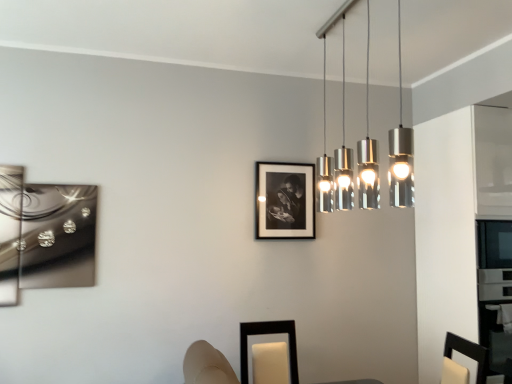
Describe the element at coordinates (269, 353) in the screenshot. The width and height of the screenshot is (512, 384). I see `black matte picture frame at lower center, which ranks as the third picture frame in top-to-bottom order` at that location.

In order to face black matte picture frame at center, acting as the third picture frame starting from the bottom, should I rotate leftwards or rightwards?

It's best to rotate right around 4.176 degrees.

Image resolution: width=512 pixels, height=384 pixels. Identify the location of black matte picture frame at center, acting as the third picture frame starting from the bottom. (284, 201).

This screenshot has width=512, height=384. I want to click on silver metallic pendant lights at upper center, so click(x=401, y=151).

The height and width of the screenshot is (384, 512). I want to click on black matte picture frame at lower center, placed as the third picture frame when sorted from back to front, so click(x=269, y=353).

Considering the positions of point (280, 209) and point (42, 232), is point (280, 209) closer or farther from the camera than point (42, 232)?

Point (280, 209) appears to be farther away from the viewer than point (42, 232).

Is the depth of black matte picture frame at center, the 3th picture frame viewed from the left, less than that of metallic silver abstract art at left, which is counted as the second picture frame, starting from the front?

No, it is behind metallic silver abstract art at left, which is counted as the second picture frame, starting from the front.

Considering the sizes of objects black matte picture frame at center, positioned as the third picture frame in front-to-back order, and metallic silver abstract art at left, placed as the 2th picture frame when sorted from bottom to top, in the image provided, who is wider, black matte picture frame at center, positioned as the third picture frame in front-to-back order, or metallic silver abstract art at left, placed as the 2th picture frame when sorted from bottom to top,?

metallic silver abstract art at left, placed as the 2th picture frame when sorted from bottom to top.

Between black matte picture frame at center, positioned as the 1th picture frame in back-to-front order, and silver metallic pendant lights at upper center, which one appears on the right side from the viewer's perspective?

From the viewer's perspective, silver metallic pendant lights at upper center appears more on the right side.

From a real-world perspective, which picture frame is the 1st one underneath the silver metallic pendant lights at upper center? Please provide its 2D coordinates.

[(284, 201)]

Which is correct: black matte picture frame at center, which appears as the 1th picture frame when viewed from the top, is inside silver metallic pendant lights at upper center, or outside of it?

black matte picture frame at center, which appears as the 1th picture frame when viewed from the top, is not enclosed by silver metallic pendant lights at upper center.

From a real-world perspective, who is located lower, metallic silver abstract art at left, placed as the 2th picture frame when sorted from bottom to top, or black matte picture frame at lower center, the 2th picture frame when ordered from right to left?

black matte picture frame at lower center, the 2th picture frame when ordered from right to left.

Can you confirm if metallic silver abstract art at left, placed as the 2th picture frame when sorted from bottom to top, is positioned to the right of black matte picture frame at lower center, which ranks as the third picture frame in top-to-bottom order?

Incorrect, metallic silver abstract art at left, placed as the 2th picture frame when sorted from bottom to top, is not on the right side of black matte picture frame at lower center, which ranks as the third picture frame in top-to-bottom order.

How many degrees apart are the facing directions of metallic silver abstract art at left, arranged as the 2th picture frame when viewed from the top, and black matte picture frame at lower center, placed as the third picture frame when sorted from back to front?

They differ by 0.782 degrees in their facing directions.

Could you measure the distance between metallic silver abstract art at left, which ranks as the 3th picture frame in right-to-left order, and black matte picture frame at lower center, placed as the third picture frame when sorted from back to front?

metallic silver abstract art at left, which ranks as the 3th picture frame in right-to-left order, and black matte picture frame at lower center, placed as the third picture frame when sorted from back to front, are 3.99 feet apart.

Considering the sizes of objects black matte picture frame at lower center, the 2th picture frame when ordered from right to left, and silver metallic pendant lights at upper center in the image provided, who is shorter, black matte picture frame at lower center, the 2th picture frame when ordered from right to left, or silver metallic pendant lights at upper center?

With less height is black matte picture frame at lower center, the 2th picture frame when ordered from right to left.

Considering the points (274, 333) and (393, 163), which point is behind, point (274, 333) or point (393, 163)?

Positioned behind is point (274, 333).

Does black matte picture frame at lower center, placed as the third picture frame when sorted from back to front, turn towards silver metallic pendant lights at upper center?

No.

From the image's perspective, which one is positioned higher, silver metallic pendant lights at upper center or black matte picture frame at lower center, positioned as the second picture frame in left-to-right order?

silver metallic pendant lights at upper center.

Do you think silver metallic pendant lights at upper center is within black matte picture frame at lower center, positioned as the second picture frame in left-to-right order, or outside of it?

silver metallic pendant lights at upper center is located beyond the bounds of black matte picture frame at lower center, positioned as the second picture frame in left-to-right order.

Does silver metallic pendant lights at upper center turn towards black matte picture frame at lower center, positioned as the second picture frame in left-to-right order?

No.

Can you confirm if silver metallic pendant lights at upper center is positioned to the left of black matte picture frame at lower center, the 2th picture frame when ordered from right to left?

In fact, silver metallic pendant lights at upper center is to the right of black matte picture frame at lower center, the 2th picture frame when ordered from right to left.

Is metallic silver abstract art at left, which is the 2th picture frame in back-to-front order, shorter than black matte picture frame at center, which appears as the 1th picture frame when viewed from the top?

In fact, metallic silver abstract art at left, which is the 2th picture frame in back-to-front order, may be taller than black matte picture frame at center, which appears as the 1th picture frame when viewed from the top.

Which object is positioned more to the right, metallic silver abstract art at left, which ranks as the 3th picture frame in right-to-left order, or black matte picture frame at center, acting as the third picture frame starting from the bottom?

Positioned to the right is black matte picture frame at center, acting as the third picture frame starting from the bottom.

How distant is metallic silver abstract art at left, which is the first picture frame in left-to-right order, from black matte picture frame at center, positioned as the third picture frame in front-to-back order?

metallic silver abstract art at left, which is the first picture frame in left-to-right order, and black matte picture frame at center, positioned as the third picture frame in front-to-back order, are 1.25 meters apart from each other.

Is metallic silver abstract art at left, placed as the 2th picture frame when sorted from bottom to top, positioned far away from black matte picture frame at center, the 3th picture frame viewed from the left?

metallic silver abstract art at left, placed as the 2th picture frame when sorted from bottom to top, is far away from black matte picture frame at center, the 3th picture frame viewed from the left.

Which is nearer, (303,234) or (262,347)?

Point (303,234) is positioned farther from the camera compared to point (262,347).

Is black matte picture frame at center, acting as the third picture frame starting from the bottom, beside black matte picture frame at lower center, positioned as the second picture frame in left-to-right order?

No.

Is black matte picture frame at center, the 3th picture frame viewed from the left, oriented towards black matte picture frame at lower center, positioned as the second picture frame in left-to-right order?

No, black matte picture frame at center, the 3th picture frame viewed from the left, does not turn towards black matte picture frame at lower center, positioned as the second picture frame in left-to-right order.

Is the position of black matte picture frame at center, marked as the first picture frame in a right-to-left arrangement, less distant than that of black matte picture frame at lower center, placed as the third picture frame when sorted from back to front?

No, black matte picture frame at center, marked as the first picture frame in a right-to-left arrangement, is further to the viewer.

This screenshot has height=384, width=512. What are the coordinates of `picture frame that is the 2nd one when counting leftward from the black matte picture frame at center, which appears as the 1th picture frame when viewed from the top` in the screenshot? It's located at (51, 231).

The height and width of the screenshot is (384, 512). Identify the location of the 3rd picture frame behind the silver metallic pendant lights at upper center, counting from the anchor's position. (284, 201).

Estimate the real-world distances between objects in this image. Which object is further from silver metallic pendant lights at upper center, metallic silver abstract art at left, which ranks as the 3th picture frame in right-to-left order, or black matte picture frame at lower center, positioned as the second picture frame in left-to-right order?

metallic silver abstract art at left, which ranks as the 3th picture frame in right-to-left order, lies further to silver metallic pendant lights at upper center than the other object.

Looking at the image, which one is located further to silver metallic pendant lights at upper center, black matte picture frame at center, positioned as the 1th picture frame in back-to-front order, or black matte picture frame at lower center, acting as the 1th picture frame starting from the bottom?

black matte picture frame at lower center, acting as the 1th picture frame starting from the bottom, is further to silver metallic pendant lights at upper center.

When comparing their distances from metallic silver abstract art at left, placed as the 2th picture frame when sorted from bottom to top, does silver metallic pendant lights at upper center or black matte picture frame at center, marked as the first picture frame in a right-to-left arrangement, seem further?

Among the two, silver metallic pendant lights at upper center is located further to metallic silver abstract art at left, placed as the 2th picture frame when sorted from bottom to top.

Which object lies further to the anchor point metallic silver abstract art at left, which is the 2th picture frame in back-to-front order, black matte picture frame at center, positioned as the 1th picture frame in back-to-front order, or black matte picture frame at lower center, acting as the 1th picture frame starting from the bottom?

black matte picture frame at center, positioned as the 1th picture frame in back-to-front order, is positioned further to the anchor metallic silver abstract art at left, which is the 2th picture frame in back-to-front order.

Which object lies nearer to the anchor point black matte picture frame at lower center, which ranks as the third picture frame in top-to-bottom order, silver metallic pendant lights at upper center or black matte picture frame at center, positioned as the 1th picture frame in back-to-front order?

Based on the image, black matte picture frame at center, positioned as the 1th picture frame in back-to-front order, appears to be nearer to black matte picture frame at lower center, which ranks as the third picture frame in top-to-bottom order.

Consider the image. Based on their spatial positions, is black matte picture frame at lower center, the 2th picture frame when ordered from right to left, or metallic silver abstract art at left, which is counted as the second picture frame, starting from the front, further from black matte picture frame at center, acting as the third picture frame starting from the bottom?

Based on the image, metallic silver abstract art at left, which is counted as the second picture frame, starting from the front, appears to be further to black matte picture frame at center, acting as the third picture frame starting from the bottom.

Which object lies further to the anchor point black matte picture frame at lower center, which ranks as the third picture frame in top-to-bottom order, black matte picture frame at center, positioned as the 1th picture frame in back-to-front order, or metallic silver abstract art at left, which is the first picture frame in left-to-right order?

metallic silver abstract art at left, which is the first picture frame in left-to-right order, is positioned further to the anchor black matte picture frame at lower center, which ranks as the third picture frame in top-to-bottom order.

Estimate the real-world distances between objects in this image. Which object is further from black matte picture frame at lower center, placed as the third picture frame when sorted from back to front, metallic silver abstract art at left, which is the 2th picture frame in back-to-front order, or silver metallic pendant lights at upper center?

metallic silver abstract art at left, which is the 2th picture frame in back-to-front order, is positioned further to the anchor black matte picture frame at lower center, placed as the third picture frame when sorted from back to front.

You are a GUI agent. You are given a task and a screenshot of the screen. Output one action in this format:
    pyautogui.click(x=<x>, y=<y>)
    Task: Click on the picture frame situated between metallic silver abstract art at left, arranged as the 2th picture frame when viewed from the top, and black matte picture frame at center, marked as the first picture frame in a right-to-left arrangement, from left to right
    This screenshot has width=512, height=384.
    Given the screenshot: What is the action you would take?
    pyautogui.click(x=269, y=353)